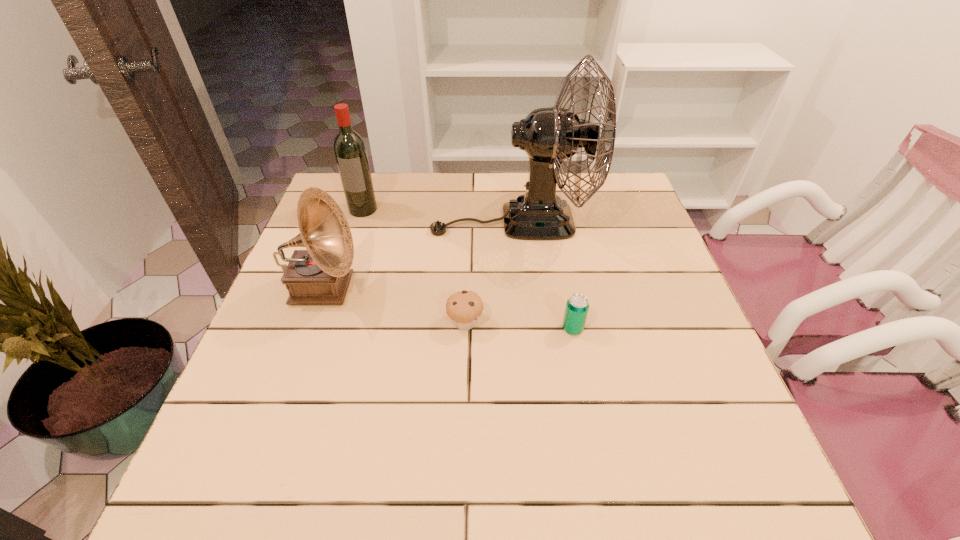
This screenshot has height=540, width=960. What are the coordinates of `free space located 0.250m on the front of the beer can` in the screenshot? It's located at (596, 448).

I want to click on free spot located 0.100m on the right of the muffin, so click(528, 323).

The height and width of the screenshot is (540, 960). I want to click on fan that is positioned at the far edge, so click(x=549, y=135).

This screenshot has height=540, width=960. I want to click on wine bottle located at the far edge, so click(x=350, y=151).

The image size is (960, 540). Identify the location of wine bottle that is at the left edge. (350, 151).

Locate an element on the screen. The height and width of the screenshot is (540, 960). phonograph record that is at the left edge is located at coordinates (320, 275).

This screenshot has height=540, width=960. Find the location of `object that is positioned at the right edge`. object that is positioned at the right edge is located at coordinates pyautogui.click(x=549, y=135).

Where is `object that is positioned at the far left corner`? The height and width of the screenshot is (540, 960). object that is positioned at the far left corner is located at coordinates (350, 151).

The width and height of the screenshot is (960, 540). I want to click on object situated at the far right corner, so click(x=549, y=135).

At what (x,y) coordinates should I click in order to perform the action: click on free spot at the near edge of the desktop. Please return your answer as a coordinate pair (x, y). This screenshot has height=540, width=960. Looking at the image, I should click on (342, 456).